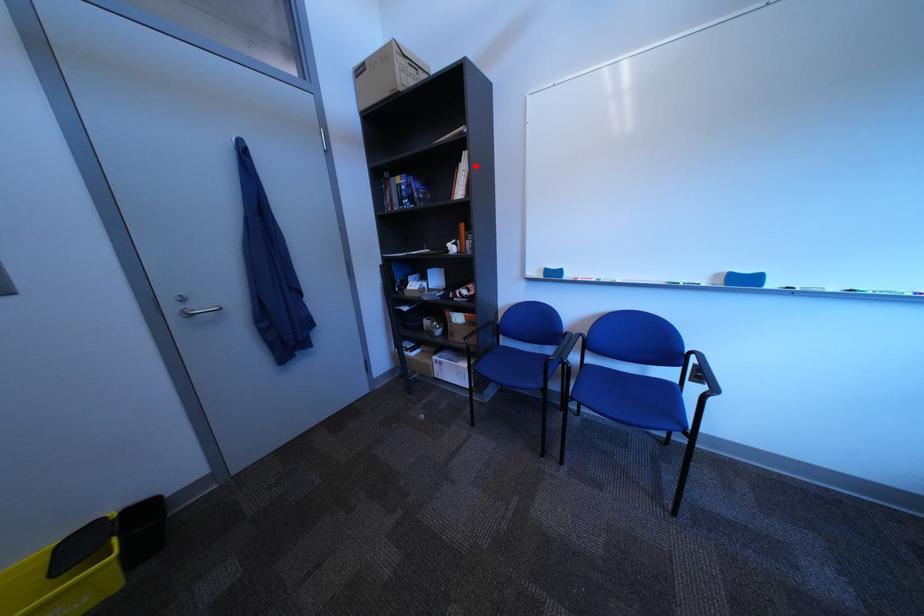
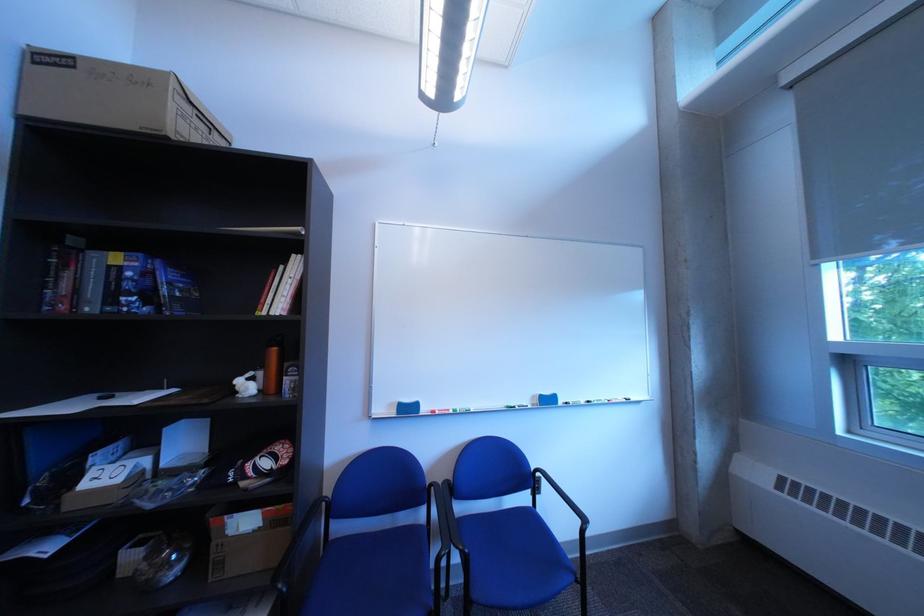
The point at the highlighted location is marked in the first image. Where is the corresponding point in the second image?

(297, 270)